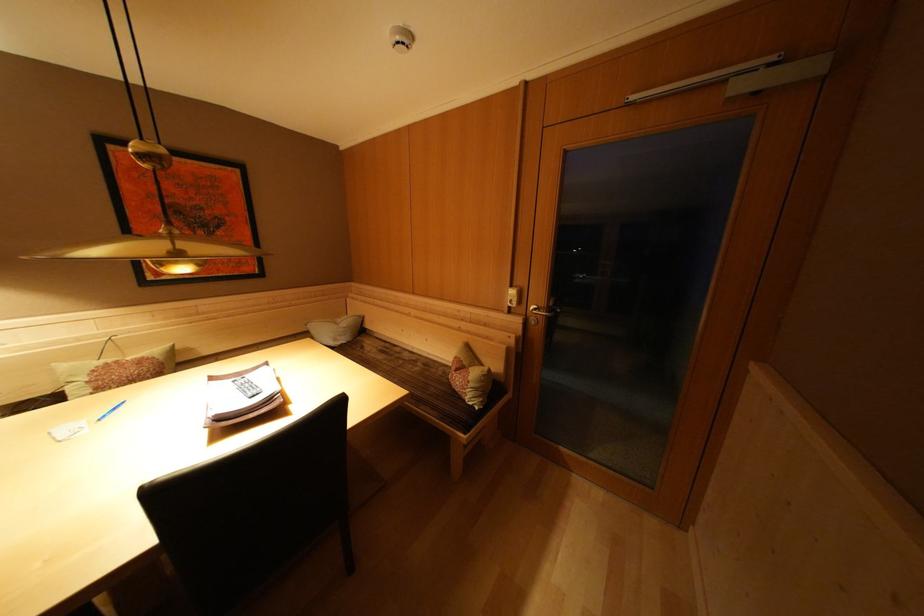
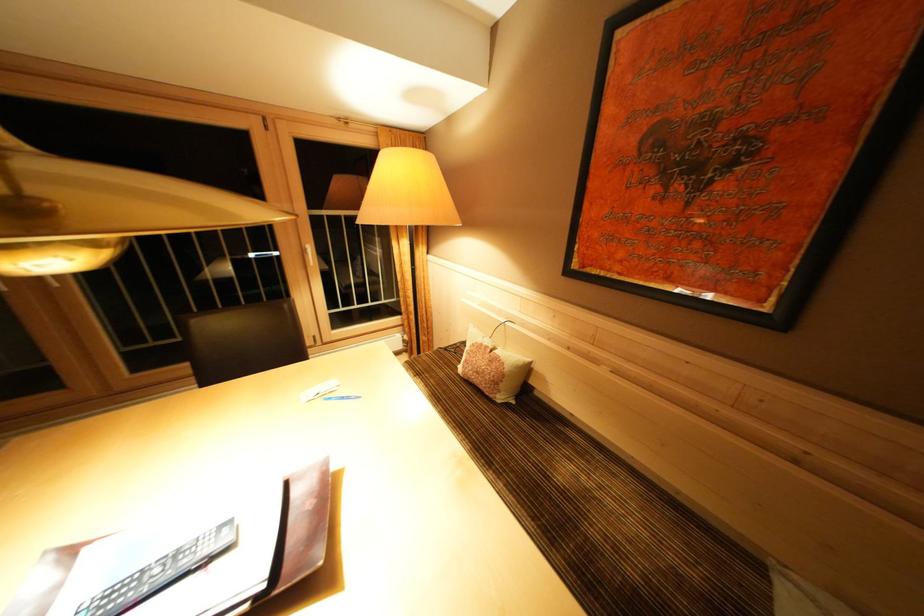
Find the pixel in the second image that matches pixel 124 367 in the first image.

(493, 352)